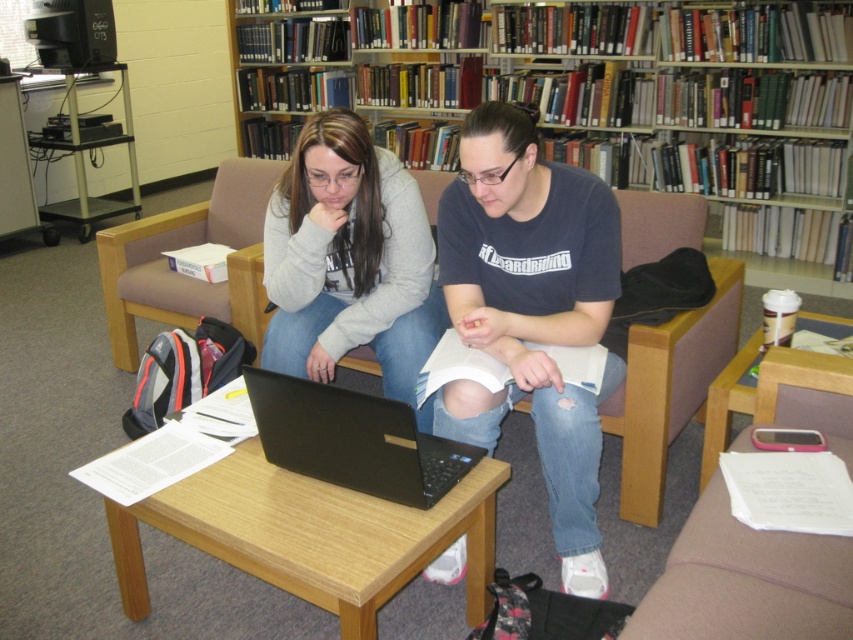
In the scene shown: You are a librarian who needs to clean the area where the matte black laptop at center and wooden table at center are located. Which object should you clean first if you want to start with the one on top?

The matte black laptop at center is positioned over wooden table at center, so you should clean the matte black laptop at center first since it is on top of the wooden table at center.

You are a delivery robot with a package that needs to be placed on the wooden table at center. The package is 6 inches wide. Can you place the package on the table without it overlapping the black matte laptop at center?

The wooden table at center and black matte laptop at center are 6.04 inches apart from each other. Since the package is 6 inches wide, it can be placed on the wooden table at center without overlapping the black matte laptop at center as there is enough space between them.

You are a librarian who needs to place a decorative item on the coffee table. The coffee table is at position point 0.3, 0.3. Is the matte gray sweater at center too far from the coffee table to place the item there?

The matte gray sweater at center is located at point (347, 259), which is farther than the coffee table at (254, 192). Therefore, the sweater is not too far, and you can place the decorative item on the coffee table.